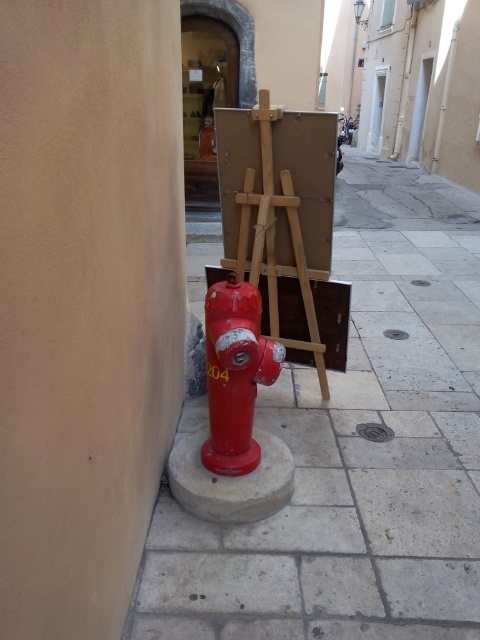
Question: Is wooden easel at center above matte red fire hydrant at center?

Choices:
 (A) no
 (B) yes

Answer: (B)

Question: Which of these objects is positioned farthest from the metallic silver extinguisher at center?

Choices:
 (A) matte red fire hydrant at center
 (B) wooden easel at center

Answer: (A)

Question: Which of the following is the farthest from the observer?

Choices:
 (A) matte red fire hydrant at center
 (B) metallic silver extinguisher at center

Answer: (B)

Question: Which of the following is the farthest from the observer?

Choices:
 (A) (277, 202)
 (B) (204, 116)
 (C) (466, 524)
 (D) (223, 346)

Answer: (B)

Question: Can you confirm if matte red fire hydrant at center is positioned to the left of metallic silver extinguisher at center?

Choices:
 (A) yes
 (B) no

Answer: (B)

Question: Can you confirm if smooth concrete pavement at center is positioned above matte red fire hydrant at center?

Choices:
 (A) yes
 (B) no

Answer: (B)